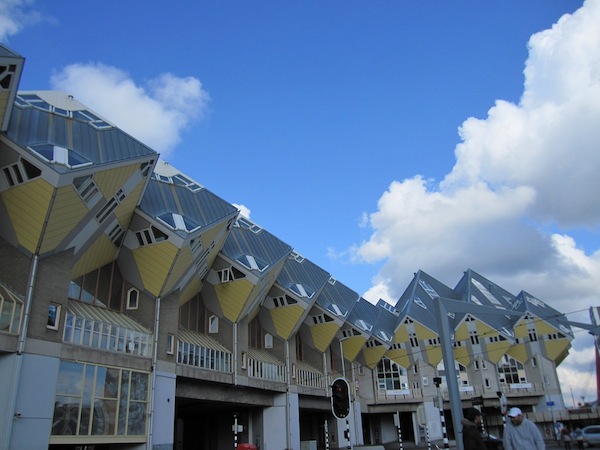
Identify the location of 1 window on the first floor. The width and height of the screenshot is (600, 450). (115, 411).